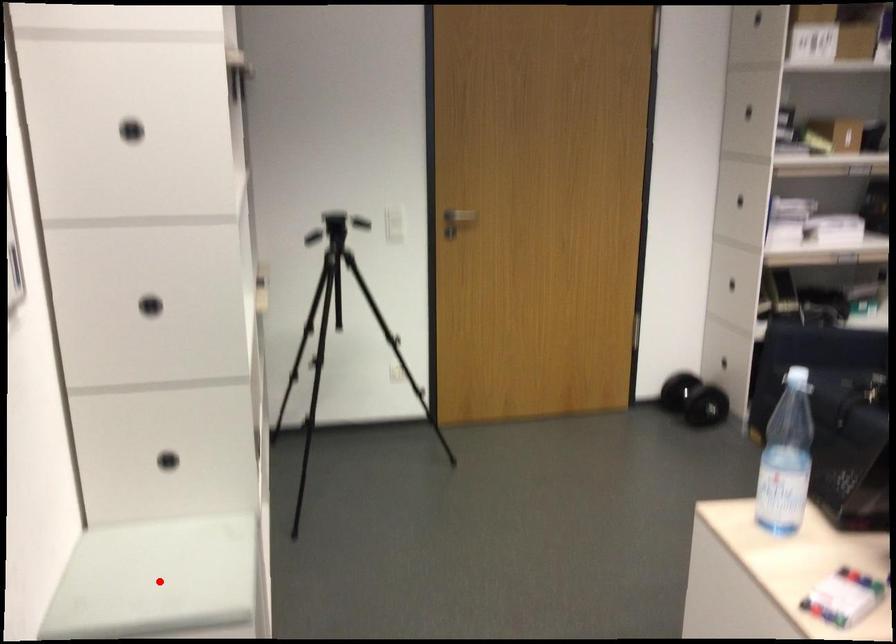
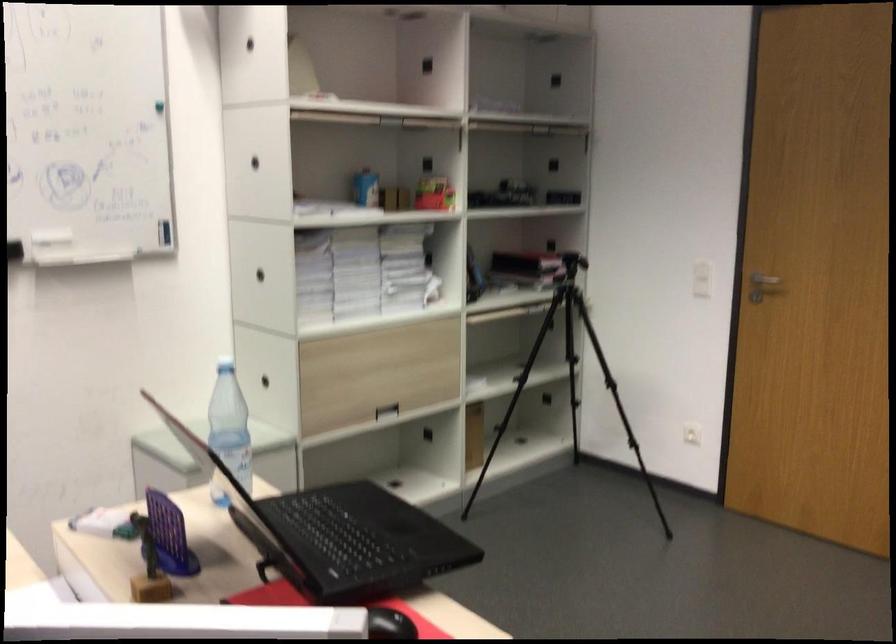
Question: I am providing you with two images of the same scene from different viewpoints. A red point is marked on the first image. At the location where the point appears in image 1, is it still visible in image 2?

Choices:
 (A) Yes
 (B) No

Answer: (B)